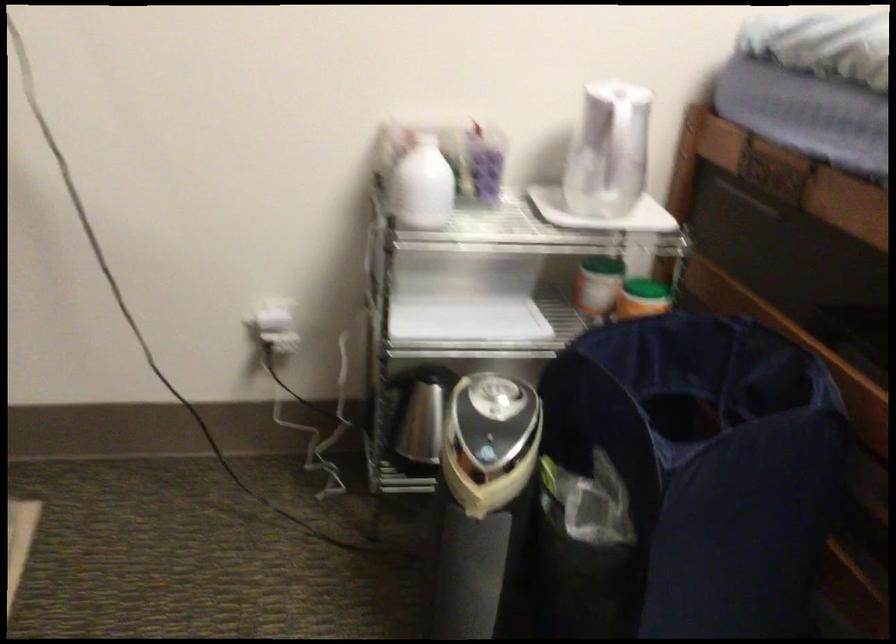
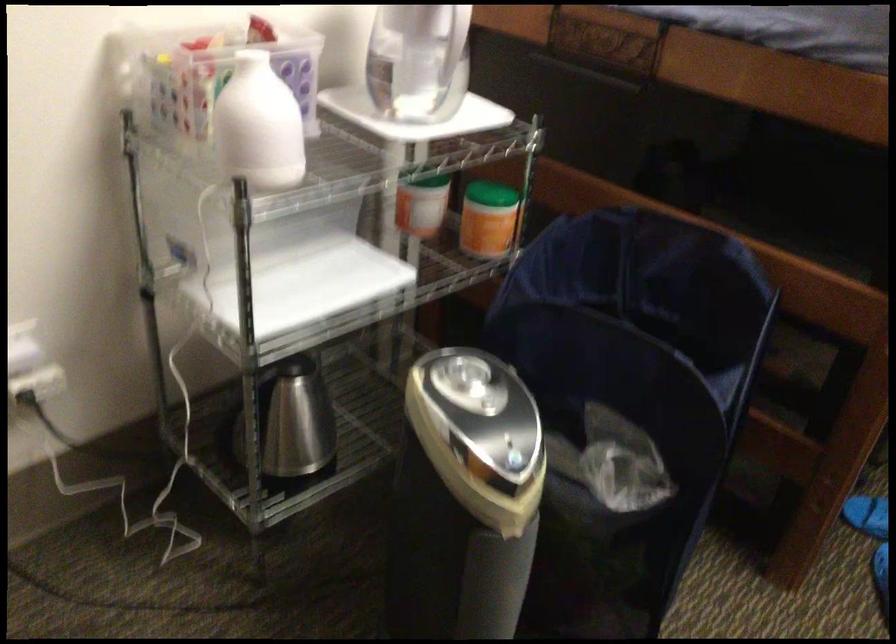
Question: The camera is either moving clockwise (left) or counter-clockwise (right) around the object. The first image is from the beginning of the video and the second image is from the end. Is the camera moving left or right when shooting the video?

Choices:
 (A) Left
 (B) Right

Answer: (A)